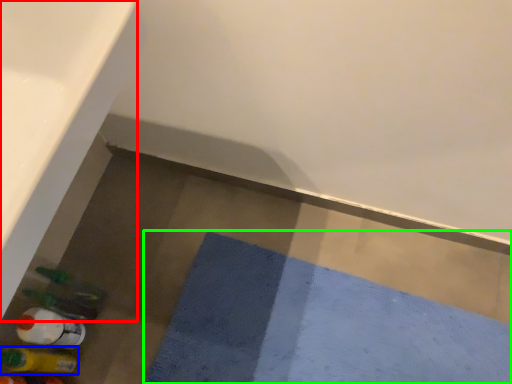
Question: Which object is positioned closest to bath (highlighted by a red box)? Select from bottle (highlighted by a blue box) and bath mat (highlighted by a green box).

Choices:
 (A) bottle
 (B) bath mat

Answer: (A)